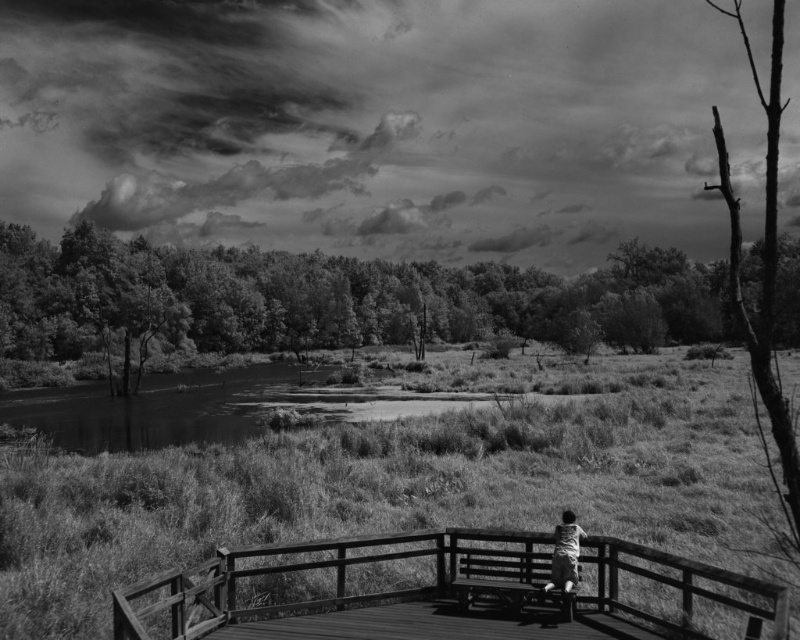
You are a photographer standing on the wooden observation deck. You want to take a photo of the wooden bridge at lower center and the light gray fabric shirt at center. Which object will appear larger in the photo?

The wooden bridge at lower center will appear larger in the photo because it is much taller than the light gray fabric shirt at center.

You are standing on the wooden observation deck where the child is sitting. You want to cross to the wooden bridge at lower center. Which direction should you walk to reach it?

The wooden bridge at lower center is located at point (448, 593), so you should walk towards the lower center direction to reach it.

You are standing on the wooden observation deck and notice the smooth water at lower left and the light gray fabric shirt at center. Which object is closer to the front of the image?

The light gray fabric shirt at center is closer to the front of the image because the smooth water at lower left is positioned under it, indicating it is behind.